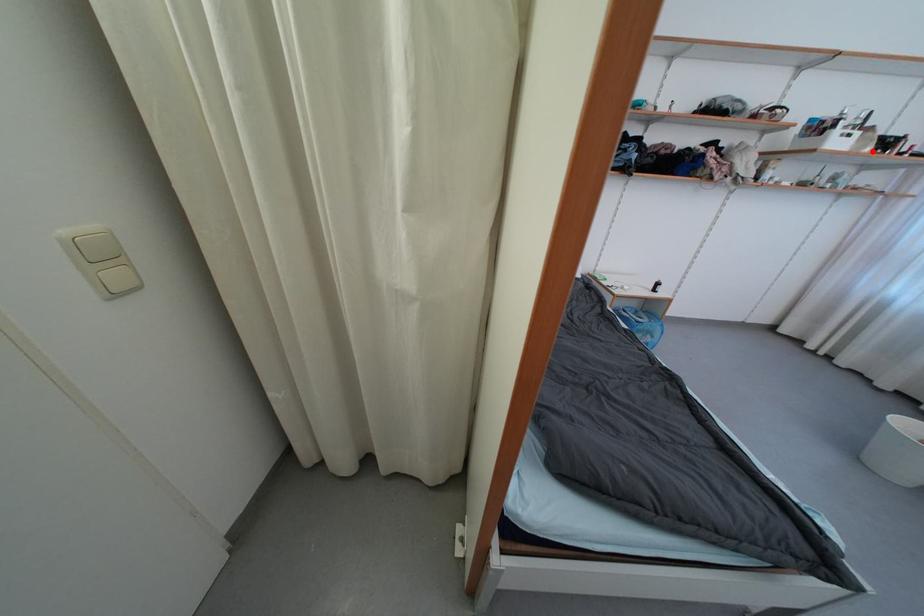
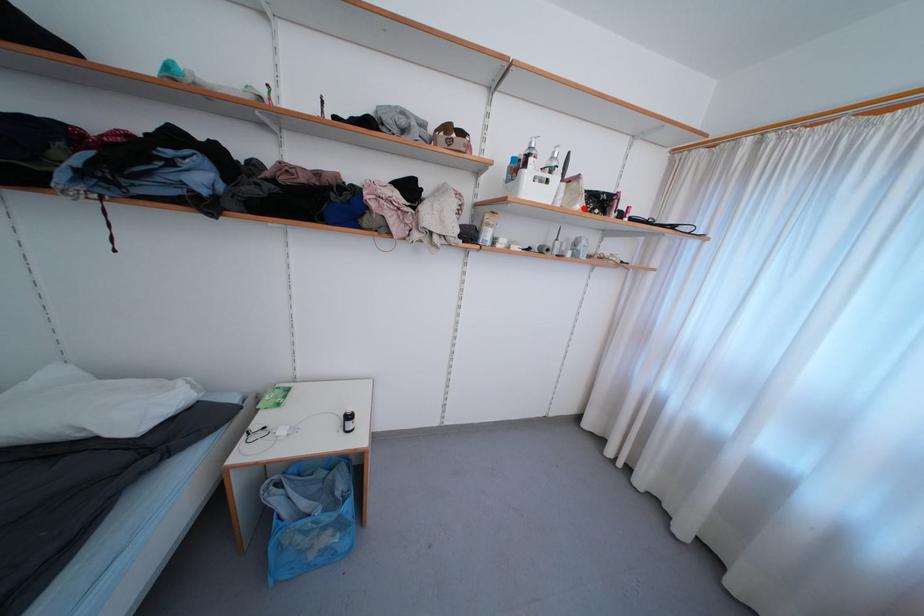
I am providing you with two images of the same scene from different viewpoints. A red point is marked on the first image and another point is marked on the second image. Does the point marked in image1 correspond to the same location as the one in image2?

Yes